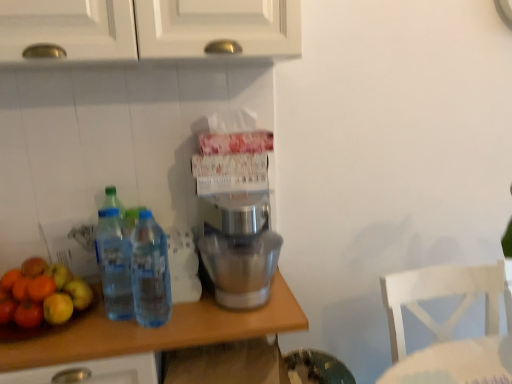
The width and height of the screenshot is (512, 384). Find the location of `vacant space in front of satin silver mixer at center`. vacant space in front of satin silver mixer at center is located at coordinates click(230, 322).